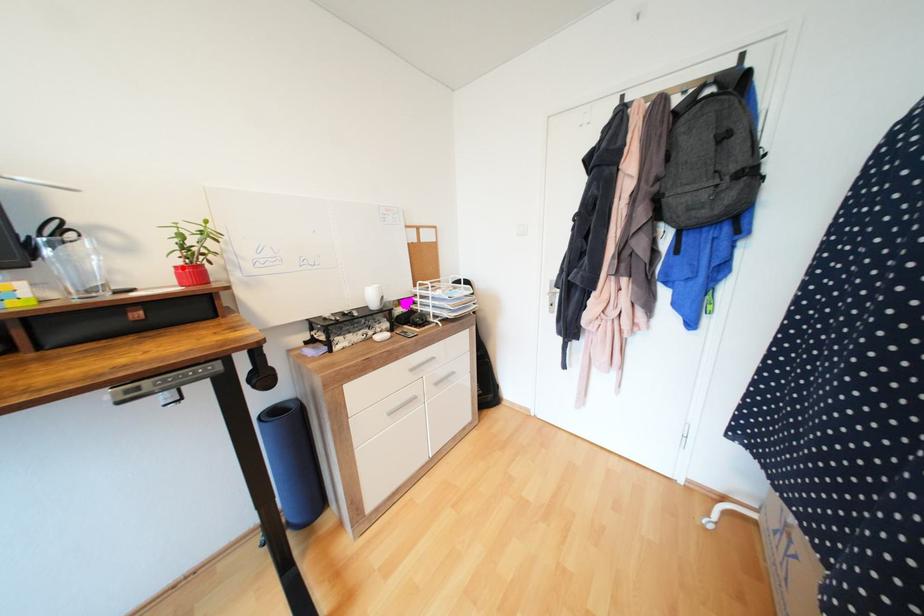
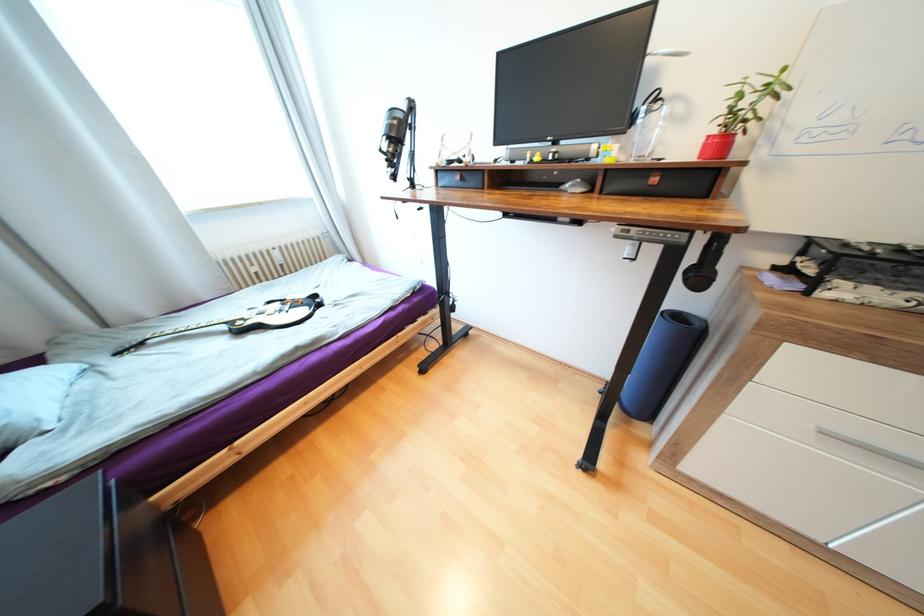
The point at the highlighted location is marked in the first image. Where is the corresponding point in the second image?

(714, 138)